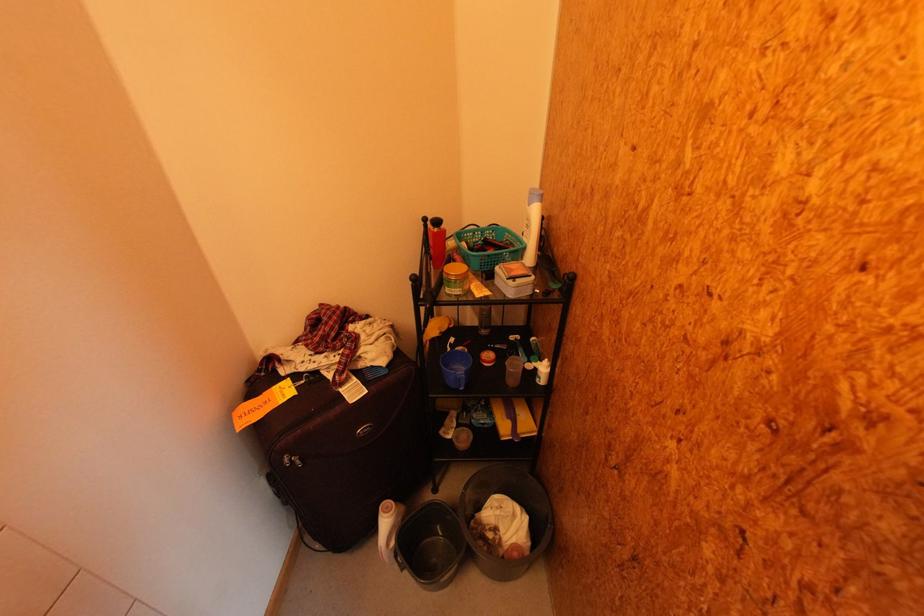
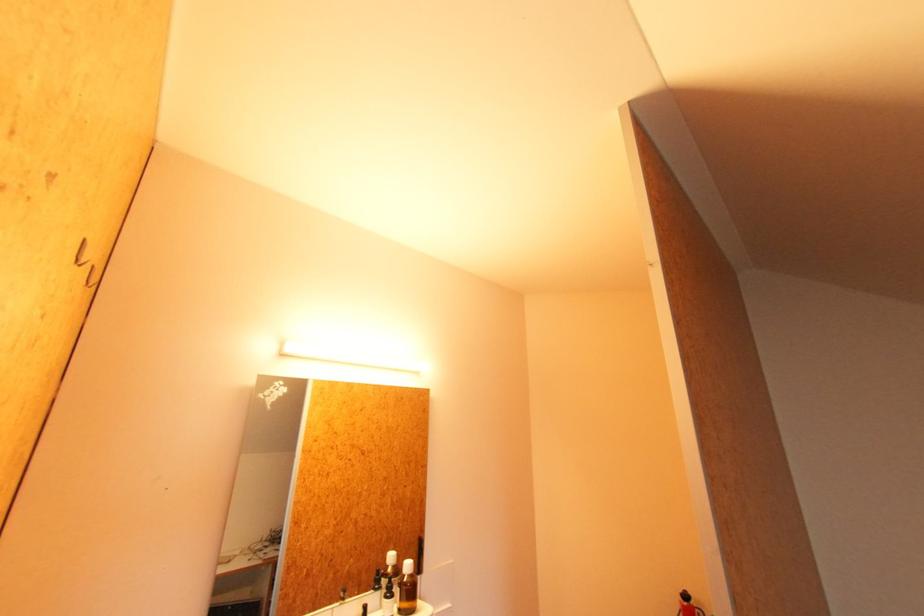
The images are taken continuously from a first-person perspective. In which direction is your viewpoint rotating?

The rotation direction of the camera is left-up.